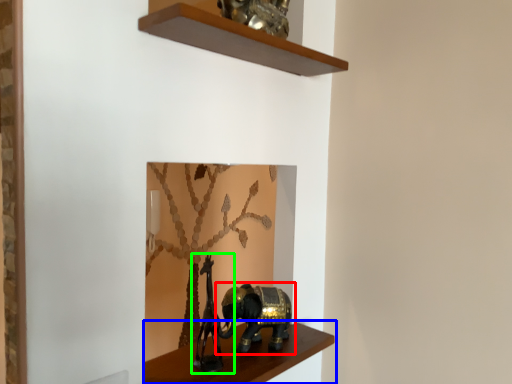
Question: Which object is the closest to the elephant (highlighted by a red box)? Choose among these: shelf (highlighted by a blue box) or animal sculpture (highlighted by a green box).

Choices:
 (A) shelf
 (B) animal sculpture

Answer: (A)